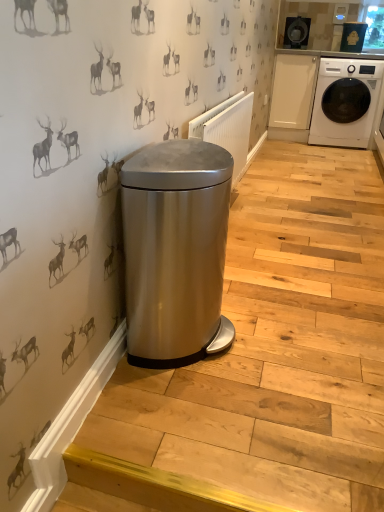
Identify the location of vacant region to the right of satin silver radiator at center. The height and width of the screenshot is (512, 384). (299, 221).